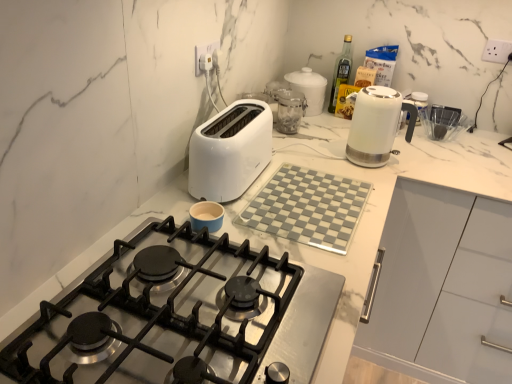
Question: Considering the positions of point coord(329,109) and point coord(312,86), is point coord(329,109) closer or farther from the camera than point coord(312,86)?

Choices:
 (A) farther
 (B) closer

Answer: (A)

Question: From the image's perspective, is clear glass bottle at upper right located above or below white glossy jar at upper center, marked as the 1th kitchen appliance in a back-to-front arrangement?

Choices:
 (A) above
 (B) below

Answer: (A)

Question: Considering the real-world distances, which object is closest to the white marble cutting board at upper center?

Choices:
 (A) white glossy electric kettle at upper right, the third kitchen appliance from the back
 (B) stainless steel gas stove at center
 (C) white plastic toaster at center
 (D) white glossy jar at upper center, marked as the 1th kitchen appliance in a back-to-front arrangement
 (E) clear glass jar at center, which ranks as the second kitchen appliance in front-to-back order

Answer: (B)

Question: Which object is the closest to the white marble cutting board at upper center?

Choices:
 (A) white glossy electric kettle at upper right, the third kitchen appliance from the back
 (B) stainless steel gas stove at center
 (C) white plastic toaster at center
 (D) clear glass jar at center, which ranks as the second kitchen appliance in front-to-back order
 (E) clear glass bottle at upper right

Answer: (B)